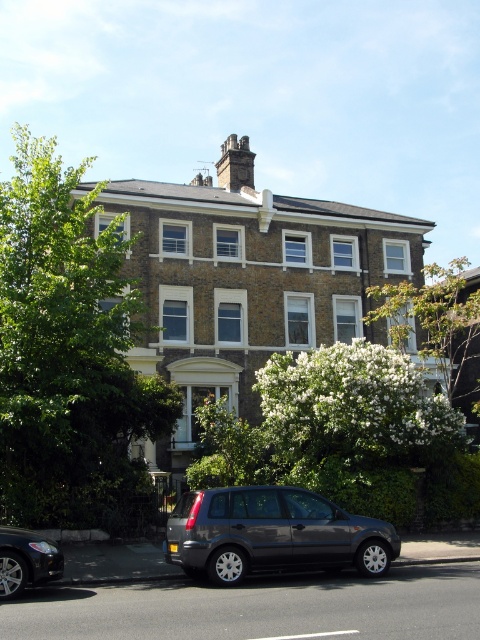
Question: Which object is positioned farthest from the dark gray stone chimney at upper center?

Choices:
 (A) dark gray metallic car at lower left
 (B) green leafy tree at left
 (C) satin dark gray suv at lower center
 (D) white blossoming tree at upper right

Answer: (B)

Question: Does white blossoming tree at upper right have a larger size compared to dark gray metallic car at lower left?

Choices:
 (A) no
 (B) yes

Answer: (B)

Question: Which is farther from the dark gray metallic car at lower left?

Choices:
 (A) white blossoming tree at upper right
 (B) satin dark gray suv at lower center

Answer: (A)

Question: Observing the image, what is the correct spatial positioning of green leafy tree at left in reference to satin dark gray suv at lower center?

Choices:
 (A) right
 (B) left

Answer: (B)

Question: Is satin dark gray suv at lower center behind dark gray stone chimney at upper center?

Choices:
 (A) yes
 (B) no

Answer: (B)

Question: Which of the following is the closest to the observer?

Choices:
 (A) dark gray stone chimney at upper center
 (B) green leafy tree at left

Answer: (B)